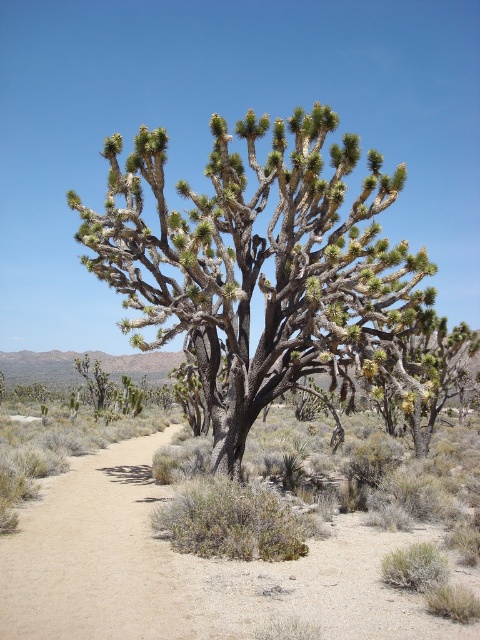
You are a hiker trying to navigate through the desert. You see a brown sandy dirt track at center and a brown sandy trail at lower left. Which path should you follow if you want to go uphill?

The brown sandy dirt track at center is located above the brown sandy trail at lower left, so you should follow the brown sandy dirt track at center to go uphill.

You are standing at the point with coordinates point (418, 618) and want to walk towards the point with coordinates point (176, 248). Will the Joshua tree block your path?

Point (176, 248) is behind point (418, 618), so the Joshua tree will block your path to point (176, 248).

From the picture: You are a hiker trying to navigate through the desert. You see the green spiny joshua tree at center and the brown sandy trail at lower left. Which direction should you head to follow the trail away from the tree?

The green spiny joshua tree at center is positioned over the brown sandy trail at lower left, so to follow the trail away from the tree, you should head in the direction opposite of the trail, which would be towards the lower right or upper right depending on the trail path. However, since the trail is at lower left under the tree, moving away from the tree towards the lower left might keep you on the trail. Wait, need to clarify based on description. The tree is over the trail, so the trail is under the t